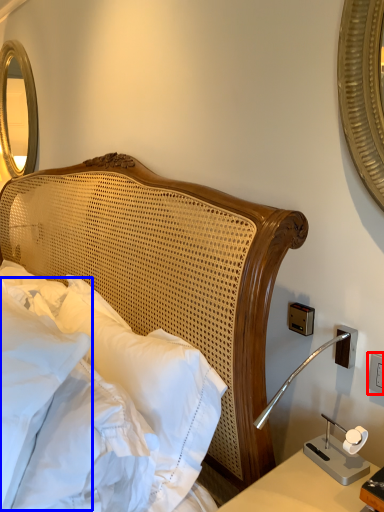
Question: Which point is further to the camera, electric outlet (highlighted by a red box) or pillow (highlighted by a blue box)?

Choices:
 (A) electric outlet
 (B) pillow

Answer: (A)